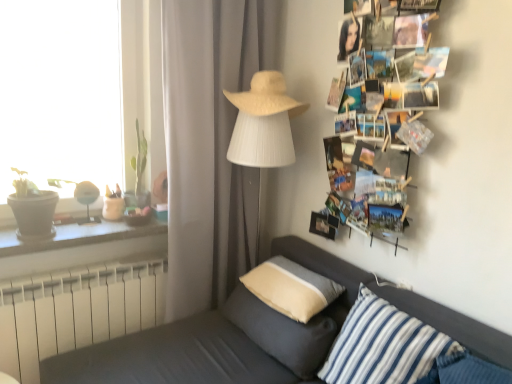
Question: Considering the relative sizes of white plastic radiator at lower left and printed paper collage at upper right in the image provided, is white plastic radiator at lower left bigger than printed paper collage at upper right?

Choices:
 (A) yes
 (B) no

Answer: (B)

Question: Could you tell me if white plastic radiator at lower left is turned towards printed paper collage at upper right?

Choices:
 (A) yes
 (B) no

Answer: (B)

Question: Is white plastic radiator at lower left turned away from printed paper collage at upper right?

Choices:
 (A) yes
 (B) no

Answer: (B)

Question: From the image's perspective, would you say white plastic radiator at lower left is positioned over printed paper collage at upper right?

Choices:
 (A) no
 (B) yes

Answer: (A)

Question: From a real-world perspective, is white plastic radiator at lower left on top of printed paper collage at upper right?

Choices:
 (A) no
 (B) yes

Answer: (A)

Question: Does white plastic radiator at lower left have a smaller size compared to printed paper collage at upper right?

Choices:
 (A) yes
 (B) no

Answer: (A)

Question: From a real-world perspective, does beige fabric pillow at center, acting as the 2th pillow starting from the front, sit lower than gray fabric curtain at center?

Choices:
 (A) no
 (B) yes

Answer: (B)

Question: Does beige fabric pillow at center, placed as the second pillow when sorted from back to front, have a smaller size compared to gray fabric curtain at center?

Choices:
 (A) no
 (B) yes

Answer: (B)

Question: Considering the relative sizes of beige fabric pillow at center, acting as the 2th pillow starting from the front, and gray fabric curtain at center in the image provided, is beige fabric pillow at center, acting as the 2th pillow starting from the front, wider than gray fabric curtain at center?

Choices:
 (A) no
 (B) yes

Answer: (B)

Question: Considering the relative sizes of beige fabric pillow at center, placed as the second pillow when sorted from back to front, and gray fabric curtain at center in the image provided, is beige fabric pillow at center, placed as the second pillow when sorted from back to front, thinner than gray fabric curtain at center?

Choices:
 (A) no
 (B) yes

Answer: (A)

Question: Is beige fabric pillow at center, acting as the 2th pillow starting from the front, far from gray fabric curtain at center?

Choices:
 (A) no
 (B) yes

Answer: (A)

Question: Considering the relative sizes of beige fabric pillow at center, acting as the 2th pillow starting from the front, and gray fabric curtain at center in the image provided, is beige fabric pillow at center, acting as the 2th pillow starting from the front, taller than gray fabric curtain at center?

Choices:
 (A) no
 (B) yes

Answer: (A)

Question: Considering the relative sizes of white fabric lampshade at center and white woven hat at upper center in the image provided, is white fabric lampshade at center shorter than white woven hat at upper center?

Choices:
 (A) no
 (B) yes

Answer: (A)